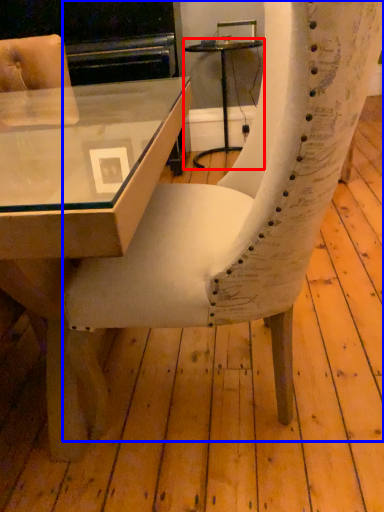
Question: Which object is closer to the camera taking this photo, table (highlighted by a red box) or chair (highlighted by a blue box)?

Choices:
 (A) table
 (B) chair

Answer: (B)